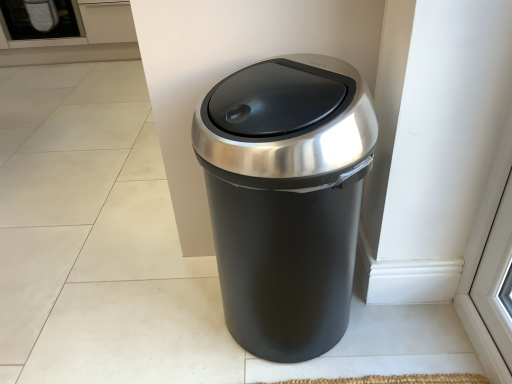
This screenshot has width=512, height=384. Identify the location of free space above black matte trash can at center (from a real-world perspective). (273, 103).